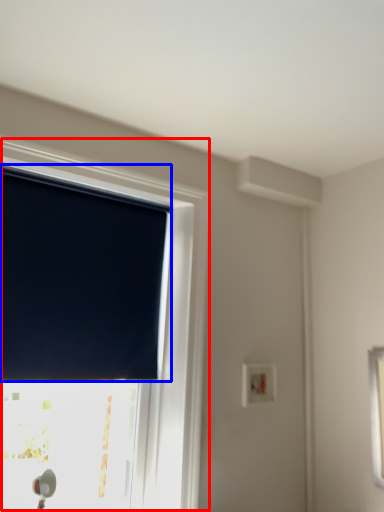
Question: Which object is further to the camera taking this photo, window (highlighted by a red box) or window blind (highlighted by a blue box)?

Choices:
 (A) window
 (B) window blind

Answer: (B)